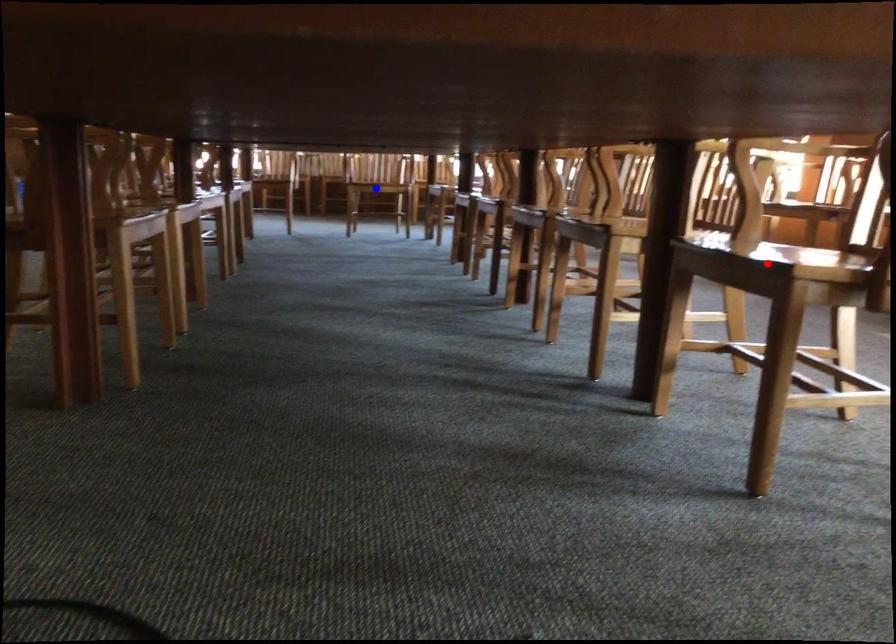
Question: In the image, two points are highlighted. Which point is nearer to the camera? Reply with the corresponding letter.

Choices:
 (A) blue point
 (B) red point

Answer: (B)